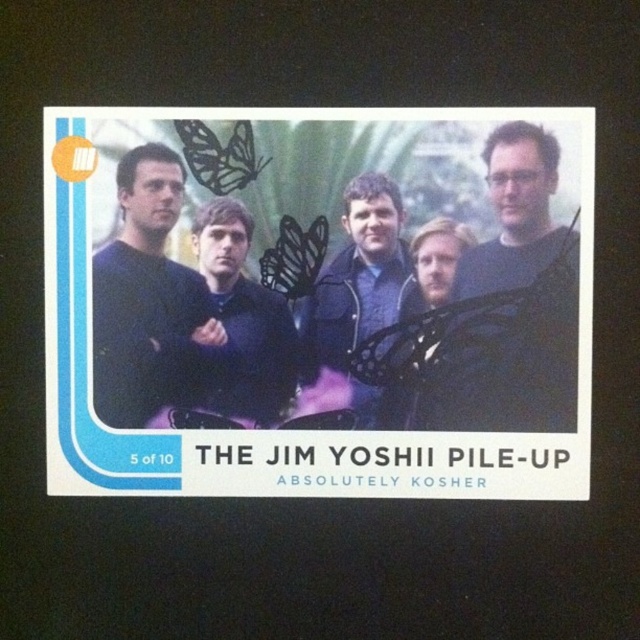
You are designing a layout for a trading card and need to place text next to the matte black group at center and the matte black jacket at center. Since the two objects are both matte black, how can you ensure the text is readable against both?

Since the matte black group at center is larger in size than the matte black jacket at center, place the text on a contrasting white background next to the smaller matte black jacket at center and use bold white text on the larger matte black group at center to ensure readability.

You are designing a poster and want to arrange the dark blue shirt at right and the dark blue sweater at center based on their sizes. Which one should you place higher up to maintain visual balance?

The dark blue shirt at right has a greater height compared to the dark blue sweater at center, so placing it higher up will help maintain visual balance by compensating for its larger size.

You are a photographer who wants to ensure the dark blue shirt at right and the dark blue sweater at center are both visible in your composition. Based on their positions, which one is higher up in the image?

The dark blue shirt at right is above the dark blue sweater at center, so it is higher up in the image.